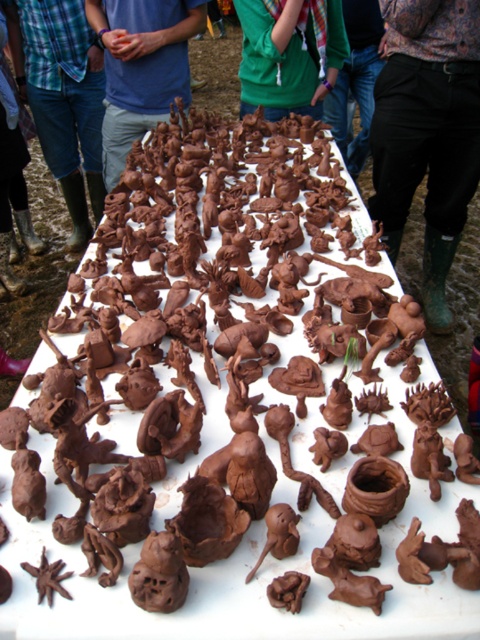
You are an artist looking at the blue matte shirt at upper center and the green matte shirt at upper center on the table. Which shirt is positioned to the left?

The blue matte shirt at upper center is positioned to the left of the green matte shirt at upper center.

You are standing in front of the table with the clay sculptures. You notice two points marked on the table at coordinates point (x=325, y=76) and point (x=364, y=10). Which point is closer to you?

Point (x=325, y=76) is closer to the viewer than point (x=364, y=10).